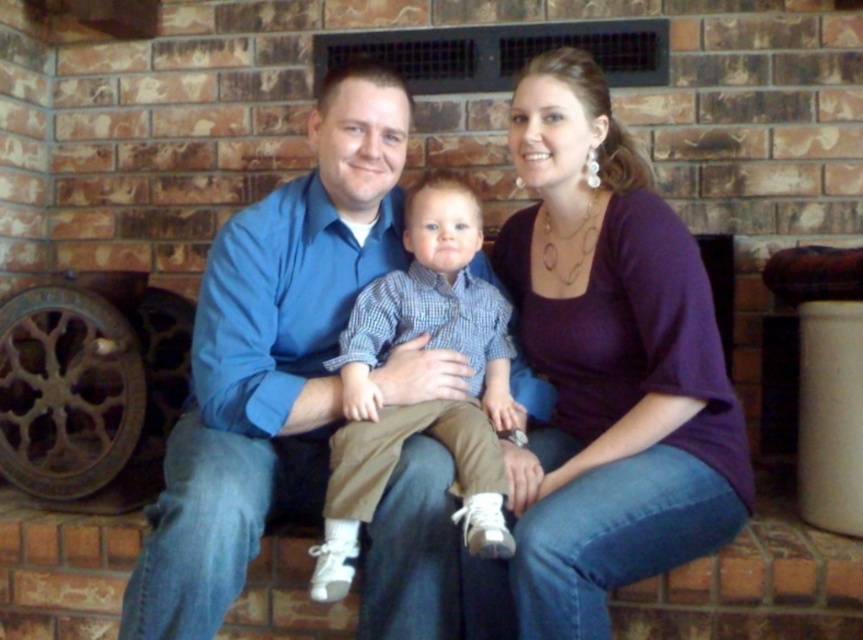
Locate an element on the screen. The width and height of the screenshot is (863, 640). blue cotton shirt at center is located at coordinates (271, 358).

Which is below, blue cotton shirt at center or checkered fabric shirt at center?

checkered fabric shirt at center is below.

Which is in front, point (317, 328) or point (335, 538)?

Positioned in front is point (335, 538).

Locate an element on the screen. blue cotton shirt at center is located at coordinates (271, 358).

Is matte blue shirt at center above purple soft shirt at center?

No.

Image resolution: width=863 pixels, height=640 pixels. What do you see at coordinates (577, 400) in the screenshot? I see `matte blue shirt at center` at bounding box center [577, 400].

Is point (387, 483) closer to viewer compared to point (608, 100)?

Yes, point (387, 483) is closer to viewer.

What are the coordinates of `matte blue shirt at center` in the screenshot? It's located at (577, 400).

Is matte blue shirt at center closer to the viewer compared to checkered fabric shirt at center?

Yes, it is.

Between matte blue shirt at center and checkered fabric shirt at center, which one has more height?

matte blue shirt at center

Describe the element at coordinates (577, 400) in the screenshot. The width and height of the screenshot is (863, 640). I see `matte blue shirt at center` at that location.

Locate an element on the screen. Image resolution: width=863 pixels, height=640 pixels. matte blue shirt at center is located at coordinates (577, 400).